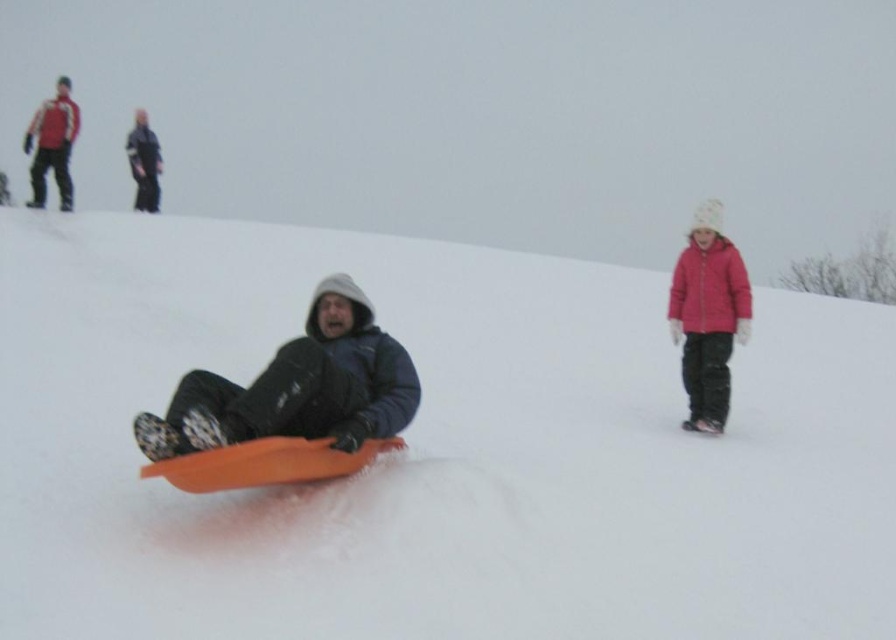
Is matte pink jacket at right positioned before brushed metal jacket at upper left?

Yes, matte pink jacket at right is closer to the viewer.

Can you confirm if matte pink jacket at right is positioned below brushed metal jacket at upper left?

Correct, matte pink jacket at right is located below brushed metal jacket at upper left.

Measure the distance between matte pink jacket at right and camera.

A distance of 30.12 feet exists between matte pink jacket at right and camera.

The height and width of the screenshot is (640, 896). Find the location of `matte pink jacket at right`. matte pink jacket at right is located at coordinates (708, 316).

Is white matte snow at center bigger than matte black jacket at center?

Correct, white matte snow at center is larger in size than matte black jacket at center.

Between point (541, 593) and point (237, 419), which one is positioned in front?

Positioned in front is point (541, 593).

The image size is (896, 640). What do you see at coordinates (435, 451) in the screenshot?
I see `white matte snow at center` at bounding box center [435, 451].

I want to click on white matte snow at center, so click(435, 451).

Who is more distant from viewer, (266,394) or (683,372)?

The point (683,372) is behind.

What are the coordinates of `matte black jacket at center` in the screenshot? It's located at pyautogui.click(x=298, y=387).

You are a GUI agent. You are given a task and a screenshot of the screen. Output one action in this format:
    pyautogui.click(x=<x>, y=<y>)
    Task: Click on the matte black jacket at center
    The height and width of the screenshot is (640, 896).
    Given the screenshot: What is the action you would take?
    pyautogui.click(x=298, y=387)